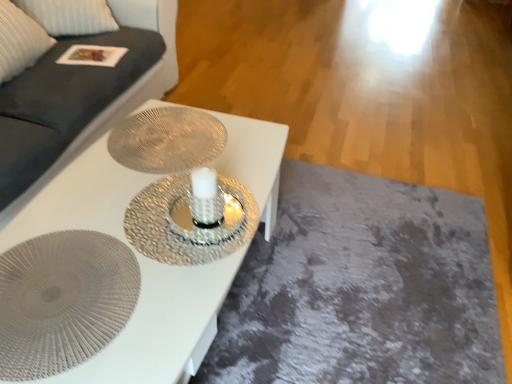
Locate an element on the screen. The image size is (512, 384). vacant point above metallic textured plate at center, positioned as the 1th oval in back-to-front order (from a real-world perspective) is located at coordinates coord(170,135).